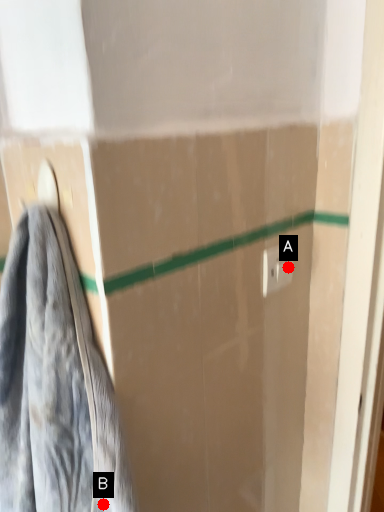
Question: Two points are circled on the image, labeled by A and B beside each circle. Which of the following is the farthest from the observer?

Choices:
 (A) A is further
 (B) B is further

Answer: (A)